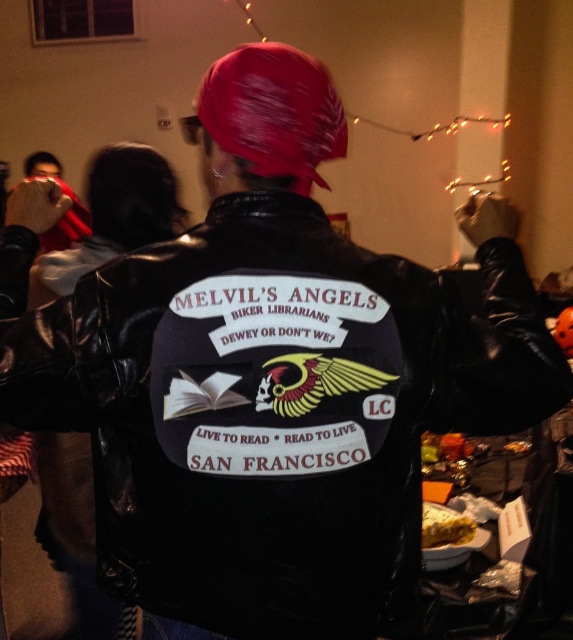
Question: Does black leather jacket at center have a smaller size compared to yellow crumbly cake at lower right?

Choices:
 (A) yes
 (B) no

Answer: (B)

Question: Is black leather jacket at center further to camera compared to yellow crumbly cake at lower right?

Choices:
 (A) yes
 (B) no

Answer: (B)

Question: Does black leather jacket at center have a lesser width compared to yellow crumbly cake at lower right?

Choices:
 (A) no
 (B) yes

Answer: (A)

Question: Which object is farther from the camera taking this photo?

Choices:
 (A) yellow crumbly cake at lower right
 (B) black leather jacket at center

Answer: (A)